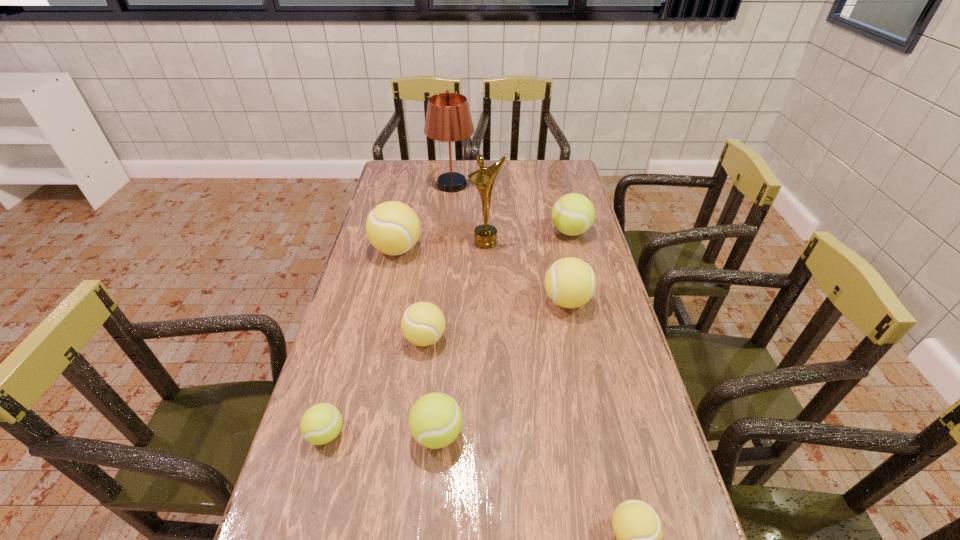
Where is `object that is at the far edge`? Image resolution: width=960 pixels, height=540 pixels. object that is at the far edge is located at coordinates (448, 118).

The height and width of the screenshot is (540, 960). In order to click on vacant area at the far edge in this screenshot , I will do `click(504, 177)`.

Where is `vacant space at the left edge of the desktop`? The width and height of the screenshot is (960, 540). vacant space at the left edge of the desktop is located at coordinates (302, 440).

You are a GUI agent. You are given a task and a screenshot of the screen. Output one action in this format:
    pyautogui.click(x=<x>, y=<y>)
    Task: Click on the blank space at the right edge of the desktop
    The width and height of the screenshot is (960, 540).
    Given the screenshot: What is the action you would take?
    pyautogui.click(x=619, y=325)

In the image, there is a desktop. Where is `free space at the far right corner`? free space at the far right corner is located at coordinates (543, 182).

At what (x,y) coordinates should I click in order to perform the action: click on empty space between the leftmost green tennis ball and the fourth farthest tennis ball. Please return your answer as a coordinate pair (x, y). Looking at the image, I should click on (375, 386).

Where is `vacant area that lies between the second biggest green tennis ball and the second farthest yellow tennis ball`? vacant area that lies between the second biggest green tennis ball and the second farthest yellow tennis ball is located at coordinates (502, 368).

Locate an element on the screen. This screenshot has height=540, width=960. object that stands as the eighth closest to the lampshade is located at coordinates (637, 527).

Select which object is the eighth closest to the fifth farthest object. Please provide its 2D coordinates. Your answer should be formatted as a tuple, i.e. [(x, y)], where the tuple contains the x and y coordinates of a point satisfying the conditions above.

[(320, 424)]

At what (x,y) coordinates should I click in order to perform the action: click on the fifth closest tennis ball to the nearest object. Please return your answer as a coordinate pair (x, y). This screenshot has height=540, width=960. Looking at the image, I should click on (573, 214).